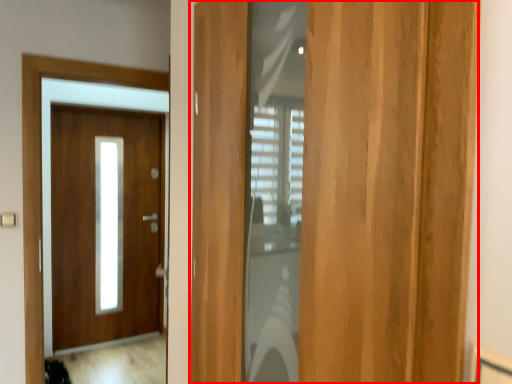
Question: From the image, what is the correct spatial relationship of door (annotated by the red box) in relation to door?

Choices:
 (A) right
 (B) left

Answer: (A)